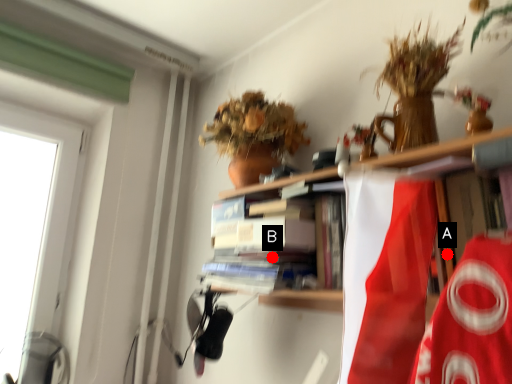
Question: Two points are circled on the image, labeled by A and B beside each circle. Which of the following is the closest to the observer?

Choices:
 (A) A is closer
 (B) B is closer

Answer: (A)